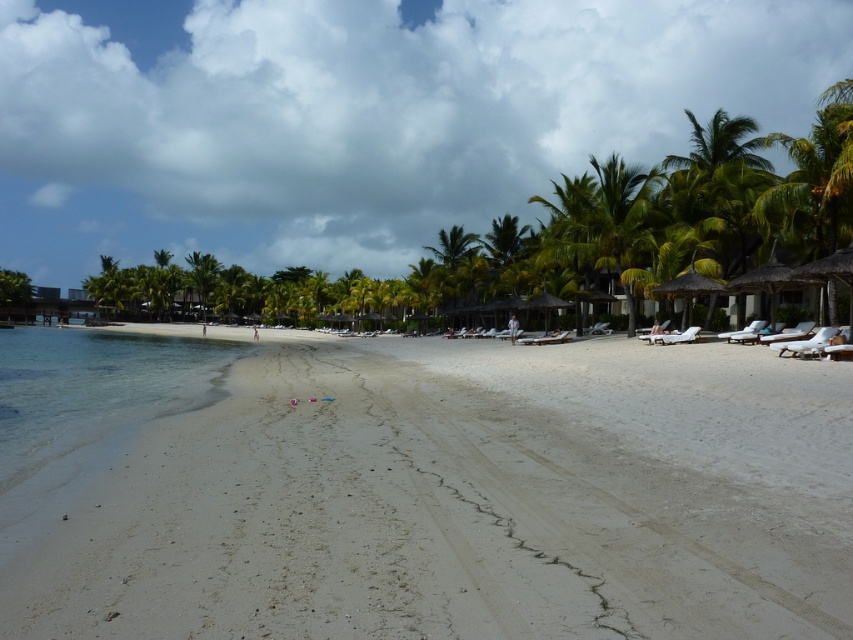
Question: Where is white sandy beach at center located in relation to clear water at lower left in the image?

Choices:
 (A) left
 (B) right

Answer: (B)

Question: Which object appears farthest from the camera in this image?

Choices:
 (A) white sandy beach at center
 (B) clear water at lower left

Answer: (B)

Question: Does white sandy beach at center appear on the left side of clear water at lower left?

Choices:
 (A) no
 (B) yes

Answer: (A)

Question: Is white sandy beach at center positioned before clear water at lower left?

Choices:
 (A) yes
 (B) no

Answer: (A)

Question: Which of the following is the farthest from the observer?

Choices:
 (A) (38, 348)
 (B) (560, 582)

Answer: (A)